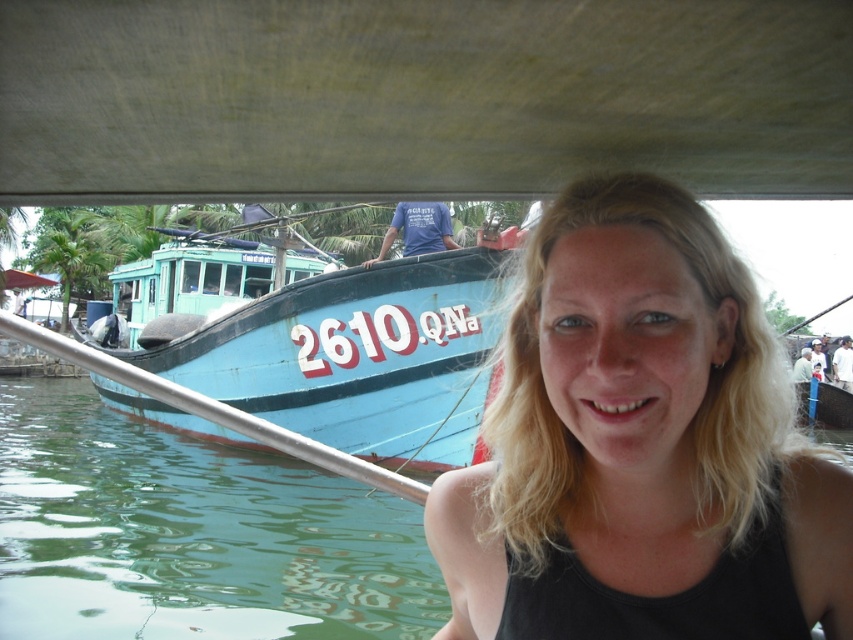
You are a photographer trying to capture a photo of the blonde hair at center and the blue matte boat at left. Based on their heights, which one should you focus on first to ensure both are in frame?

The blonde hair at center has a lesser height compared to the blue matte boat at left, so you should focus on the blue matte boat at left first to ensure both are in frame.

You are a photographer standing at the bridge, wanting to take a photo of the blonde hair at center and the blue matte boat at left. If your camera has a maximum focus range of 8 meters, will both subjects be in focus?

The blonde hair at center and blue matte boat at left are 8.44 meters apart from each other. Since the camera can only focus up to 8 meters, the distance between them exceeds the focus range, so both subjects cannot be in focus simultaneously.

You are a photographer taking a picture of the blonde hair at center and the blue matte boat at left. Which object appears narrower in the photo?

The blonde hair at center appears narrower than the blue matte boat at left in the photo.